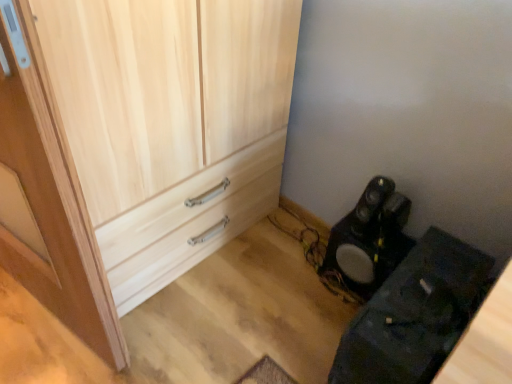
Find the location of a particular element. free space in front of black matte speaker at lower right is located at coordinates (333, 320).